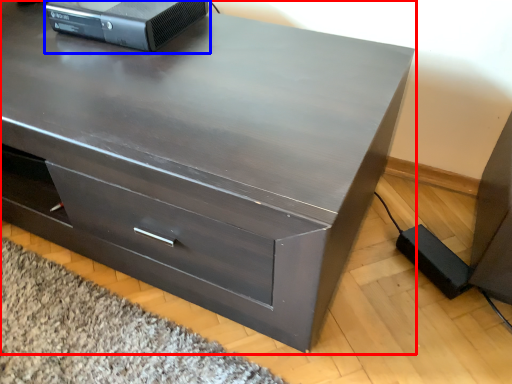
Question: Which point is closer to the camera, chest of drawers (highlighted by a red box) or desktop computer (highlighted by a blue box)?

Choices:
 (A) chest of drawers
 (B) desktop computer

Answer: (A)